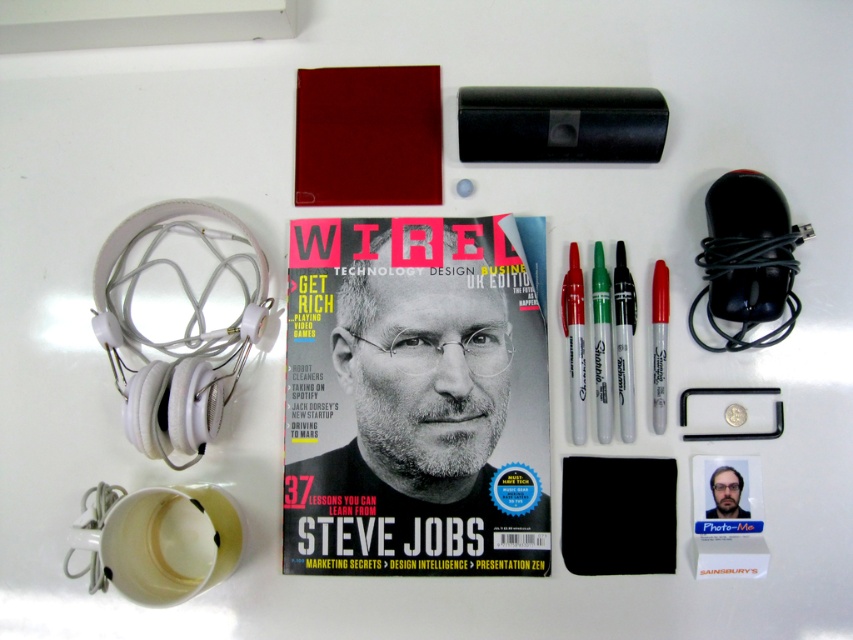
Looking at this image, who is taller, matte paper magazine at center or silver metallic marker at center?

matte paper magazine at center

Which of these two, matte paper magazine at center or silver metallic marker at center, stands shorter?

silver metallic marker at center

Locate an element on the screen. The height and width of the screenshot is (640, 853). matte paper magazine at center is located at coordinates (415, 400).